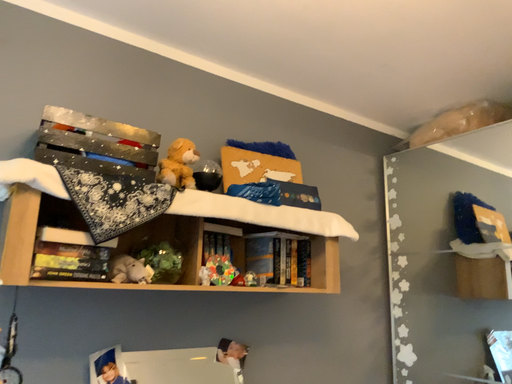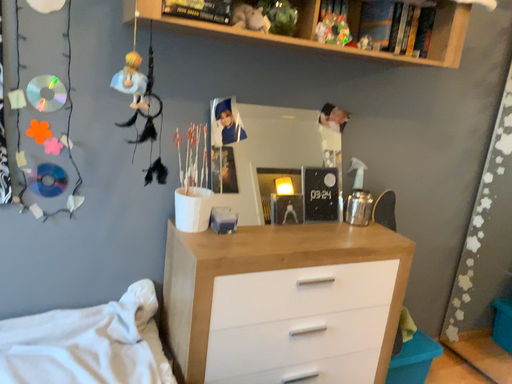
Question: How did the camera likely rotate when shooting the video?

Choices:
 (A) rotated downward
 (B) rotated upward

Answer: (A)